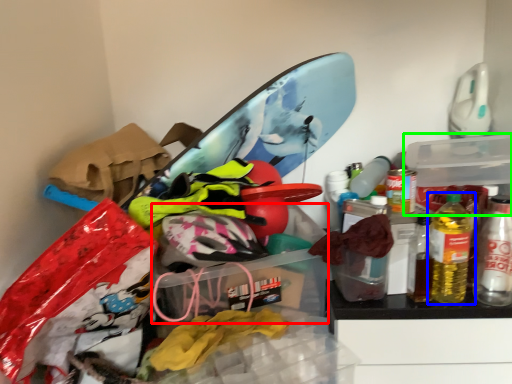
Question: Which object is the closest to the storage box (highlighted by a red box)? Choose among these: bottle (highlighted by a blue box) or storage box (highlighted by a green box).

Choices:
 (A) bottle
 (B) storage box

Answer: (A)